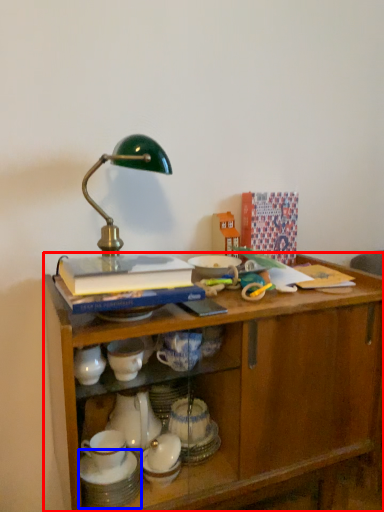
Question: Among these objects, which one is farthest to the camera, desk (highlighted by a red box) or tableware (highlighted by a blue box)?

Choices:
 (A) desk
 (B) tableware

Answer: (B)